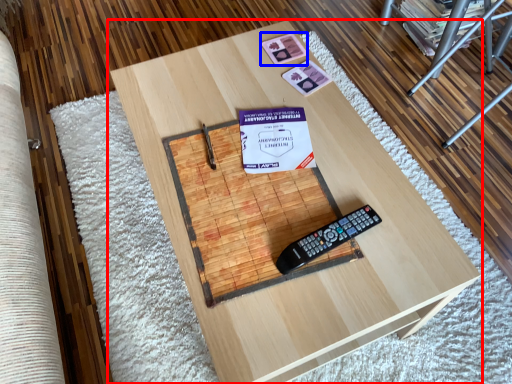
Question: Which point is closer to the camera, table (highlighted by a red box) or square (highlighted by a blue box)?

Choices:
 (A) table
 (B) square

Answer: (A)